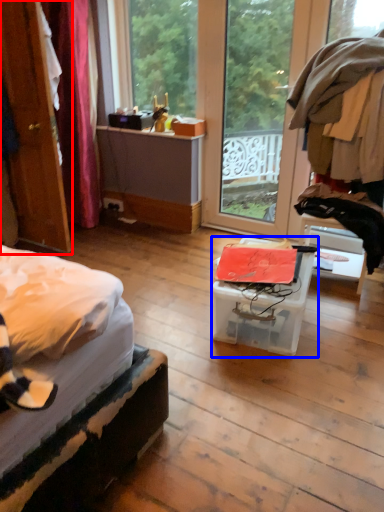
Question: Which object appears farthest to the camera in this image, door (highlighted by a red box) or box (highlighted by a blue box)?

Choices:
 (A) door
 (B) box

Answer: (A)